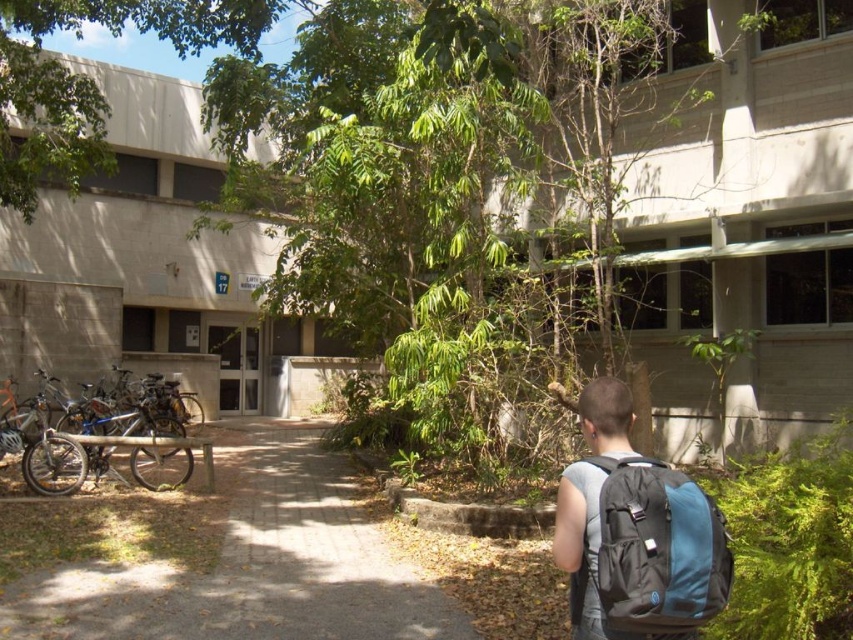
You are a delivery person with a cart that is 1.2 meters wide. You need to navigate through the brick paved path at center to reach the entrance of the building. Can your cart fit through the path if there is a silver metallic bicycle at left parked nearby?

The brick paved path at center is smaller than the silver metallic bicycle at left, which means the path is narrower than the bicycle. Since the bicycle is parked nearby, the path might be blocked or too narrow for the cart to pass through safely. The cart is 1.2 meters wide, so it likely cannot fit through the path.